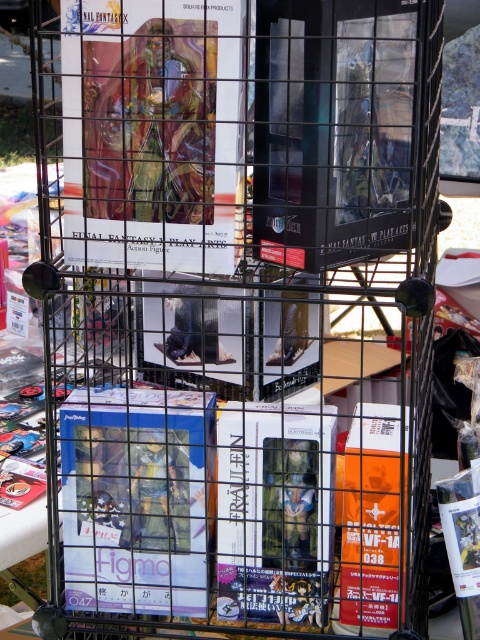
Question: Which point is farther from the camera taking this photo?

Choices:
 (A) (264, 600)
 (B) (383, 579)
 (C) (190, 141)
 (D) (81, 548)

Answer: (D)

Question: Does matte plastic poster at upper left have a greater width compared to orange matte vf-1 at lower right?

Choices:
 (A) no
 (B) yes

Answer: (B)

Question: Which point is farther to the camera?

Choices:
 (A) matte plastic figure at center
 (B) matte plastic poster at upper left

Answer: (A)

Question: Is matte plastic poster at upper left above matte white book at center?

Choices:
 (A) no
 (B) yes

Answer: (B)

Question: Which of the following is the closest to the observer?

Choices:
 (A) (73, 582)
 (B) (357, 561)
 (C) (265, 493)
 (D) (207, 84)

Answer: (D)

Question: Can you confirm if matte plastic poster at upper left is positioned to the left of orange matte vf-1 at lower right?

Choices:
 (A) no
 (B) yes

Answer: (B)